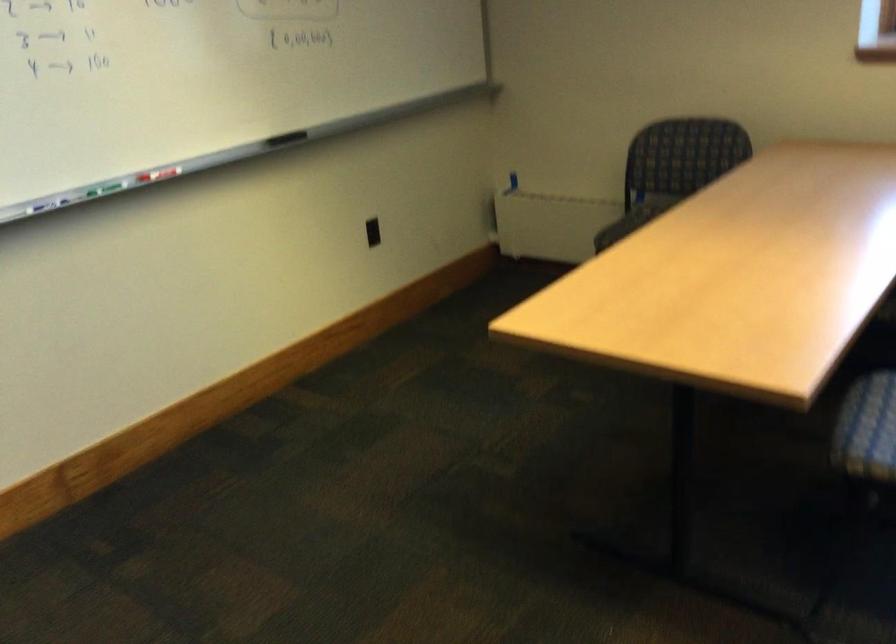
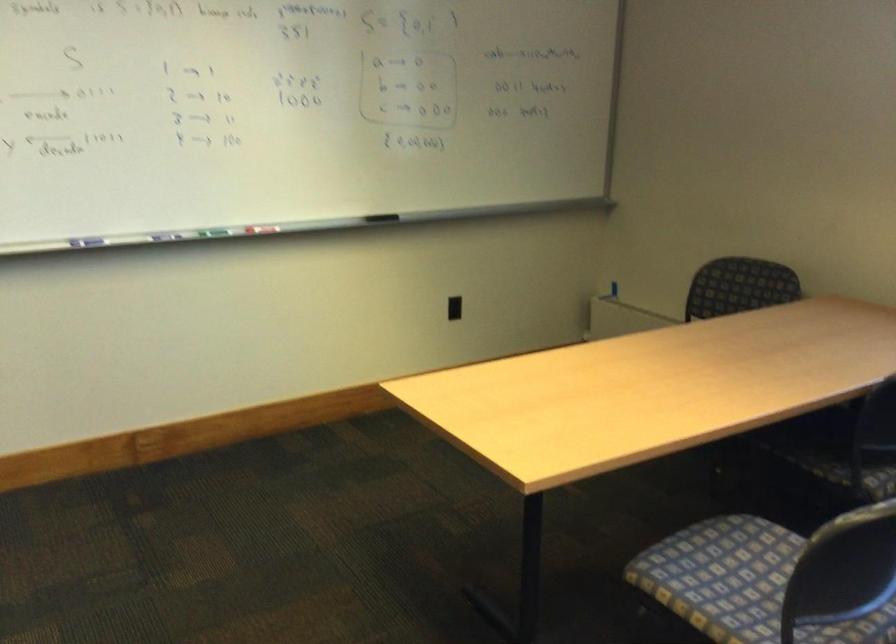
Question: Based on the continuous images, in which direction is the camera rotating? Reply with the corresponding letter.

Choices:
 (A) Left
 (B) Right
 (C) Up
 (D) Down

Answer: (A)